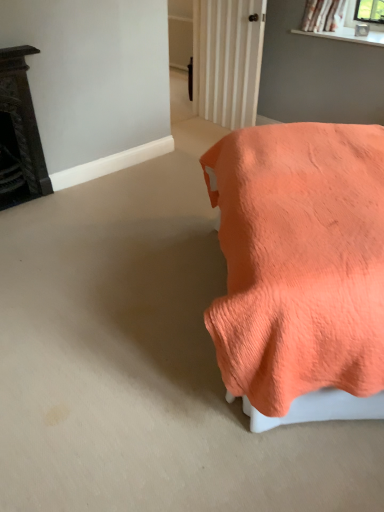
Describe the element at coordinates (300, 269) in the screenshot. I see `coral fabric bed at right, the 1th furniture from the right` at that location.

Find the location of a particular element. The width and height of the screenshot is (384, 512). coral fabric bed at right, the 1th furniture from the right is located at coordinates (300, 269).

Where is `dark brown ornate fireplace at left, which is the second furniture from right to left`? This screenshot has width=384, height=512. dark brown ornate fireplace at left, which is the second furniture from right to left is located at coordinates (19, 133).

The width and height of the screenshot is (384, 512). What do you see at coordinates (19, 133) in the screenshot? I see `dark brown ornate fireplace at left, arranged as the 1th furniture when viewed from the left` at bounding box center [19, 133].

Find the location of a particular element. Image resolution: width=384 pixels, height=512 pixels. coral fabric bed at right, which is the 2th furniture from left to right is located at coordinates (300, 269).

In the scene shown: Considering the relative positions of coral fabric bed at right, which is the 2th furniture from left to right, and dark brown ornate fireplace at left, which is the second furniture from right to left, in the image provided, is coral fabric bed at right, which is the 2th furniture from left to right, to the left of dark brown ornate fireplace at left, which is the second furniture from right to left, from the viewer's perspective?

No.

In the image, is coral fabric bed at right, the 1th furniture from the right, positioned in front of or behind dark brown ornate fireplace at left, which is the second furniture from right to left?

coral fabric bed at right, the 1th furniture from the right, is positioned closer to the viewer than dark brown ornate fireplace at left, which is the second furniture from right to left.

Is point (296, 178) in front of point (19, 50)?

Yes, point (296, 178) is closer to viewer.

From the image's perspective, which is below, coral fabric bed at right, the 1th furniture from the right, or dark brown ornate fireplace at left, arranged as the 1th furniture when viewed from the left?

coral fabric bed at right, the 1th furniture from the right, from the image's perspective.

From a real-world perspective, who is located higher, coral fabric bed at right, the 1th furniture from the right, or dark brown ornate fireplace at left, arranged as the 1th furniture when viewed from the left?

coral fabric bed at right, the 1th furniture from the right, is physically above.

Can you confirm if coral fabric bed at right, the 1th furniture from the right, is wider than dark brown ornate fireplace at left, which is the second furniture from right to left?

Correct, the width of coral fabric bed at right, the 1th furniture from the right, exceeds that of dark brown ornate fireplace at left, which is the second furniture from right to left.

Considering the relative sizes of coral fabric bed at right, the 1th furniture from the right, and dark brown ornate fireplace at left, which is the second furniture from right to left, in the image provided, is coral fabric bed at right, the 1th furniture from the right, shorter than dark brown ornate fireplace at left, which is the second furniture from right to left,?

No, coral fabric bed at right, the 1th furniture from the right, is not shorter than dark brown ornate fireplace at left, which is the second furniture from right to left.

In terms of size, does coral fabric bed at right, the 1th furniture from the right, appear bigger or smaller than dark brown ornate fireplace at left, arranged as the 1th furniture when viewed from the left?

Considering their sizes, coral fabric bed at right, the 1th furniture from the right, takes up more space than dark brown ornate fireplace at left, arranged as the 1th furniture when viewed from the left.

Is dark brown ornate fireplace at left, arranged as the 1th furniture when viewed from the left, a part of coral fabric bed at right, which is the 2th furniture from left to right?

No.

Is coral fabric bed at right, which is the 2th furniture from left to right, with dark brown ornate fireplace at left, arranged as the 1th furniture when viewed from the left?

No, coral fabric bed at right, which is the 2th furniture from left to right, is not touching dark brown ornate fireplace at left, arranged as the 1th furniture when viewed from the left.

Is coral fabric bed at right, the 1th furniture from the right, oriented away from dark brown ornate fireplace at left, arranged as the 1th furniture when viewed from the left?

coral fabric bed at right, the 1th furniture from the right, is not turned away from dark brown ornate fireplace at left, arranged as the 1th furniture when viewed from the left.

Can you tell me how much coral fabric bed at right, which is the 2th furniture from left to right, and dark brown ornate fireplace at left, which is the second furniture from right to left, differ in facing direction?

134 degrees separate the facing orientations of coral fabric bed at right, which is the 2th furniture from left to right, and dark brown ornate fireplace at left, which is the second furniture from right to left.

Where is `furniture in front of the dark brown ornate fireplace at left, which is the second furniture from right to left`? The height and width of the screenshot is (512, 384). furniture in front of the dark brown ornate fireplace at left, which is the second furniture from right to left is located at coordinates click(300, 269).

Between dark brown ornate fireplace at left, which is the second furniture from right to left, and coral fabric bed at right, which is the 2th furniture from left to right, which one appears on the left side from the viewer's perspective?

dark brown ornate fireplace at left, which is the second furniture from right to left.

Considering the positions of objects dark brown ornate fireplace at left, arranged as the 1th furniture when viewed from the left, and coral fabric bed at right, the 1th furniture from the right, in the image provided, who is behind, dark brown ornate fireplace at left, arranged as the 1th furniture when viewed from the left, or coral fabric bed at right, the 1th furniture from the right,?

dark brown ornate fireplace at left, arranged as the 1th furniture when viewed from the left, is behind.

Considering the positions of points (10, 181) and (276, 298), is point (10, 181) closer to camera compared to point (276, 298)?

That is False.

From the image's perspective, is dark brown ornate fireplace at left, arranged as the 1th furniture when viewed from the left, located above or below coral fabric bed at right, which is the 2th furniture from left to right?

Clearly, from the image's perspective, dark brown ornate fireplace at left, arranged as the 1th furniture when viewed from the left, is above coral fabric bed at right, which is the 2th furniture from left to right.

From a real-world perspective, is dark brown ornate fireplace at left, arranged as the 1th furniture when viewed from the left, positioned over coral fabric bed at right, the 1th furniture from the right, based on gravity?

No, from a real-world perspective, dark brown ornate fireplace at left, arranged as the 1th furniture when viewed from the left, is not over coral fabric bed at right, the 1th furniture from the right

Considering the sizes of dark brown ornate fireplace at left, arranged as the 1th furniture when viewed from the left, and coral fabric bed at right, which is the 2th furniture from left to right, in the image, is dark brown ornate fireplace at left, arranged as the 1th furniture when viewed from the left, wider or thinner than coral fabric bed at right, which is the 2th furniture from left to right,?

Considering their sizes, dark brown ornate fireplace at left, arranged as the 1th furniture when viewed from the left, looks slimmer than coral fabric bed at right, which is the 2th furniture from left to right.

Who is taller, dark brown ornate fireplace at left, arranged as the 1th furniture when viewed from the left, or coral fabric bed at right, which is the 2th furniture from left to right?

coral fabric bed at right, which is the 2th furniture from left to right.

In terms of size, does dark brown ornate fireplace at left, which is the second furniture from right to left, appear bigger or smaller than coral fabric bed at right, the 1th furniture from the right?

Clearly, dark brown ornate fireplace at left, which is the second furniture from right to left, is smaller in size than coral fabric bed at right, the 1th furniture from the right.

Is dark brown ornate fireplace at left, arranged as the 1th furniture when viewed from the left, not inside coral fabric bed at right, which is the 2th furniture from left to right?

dark brown ornate fireplace at left, arranged as the 1th furniture when viewed from the left, lies outside coral fabric bed at right, which is the 2th furniture from left to right,'s area.

Would you consider dark brown ornate fireplace at left, arranged as the 1th furniture when viewed from the left, to be distant from coral fabric bed at right, which is the 2th furniture from left to right?

Yes.

Could you tell me if dark brown ornate fireplace at left, arranged as the 1th furniture when viewed from the left, is facing coral fabric bed at right, which is the 2th furniture from left to right?

Yes, dark brown ornate fireplace at left, arranged as the 1th furniture when viewed from the left, faces towards coral fabric bed at right, which is the 2th furniture from left to right.

Can you tell me how much dark brown ornate fireplace at left, which is the second furniture from right to left, and coral fabric bed at right, which is the 2th furniture from left to right, differ in facing direction?

dark brown ornate fireplace at left, which is the second furniture from right to left, and coral fabric bed at right, which is the 2th furniture from left to right, are facing 134 degrees away from each other.

You are a GUI agent. You are given a task and a screenshot of the screen. Output one action in this format:
    pyautogui.click(x=<x>, y=<y>)
    Task: Click on the furniture above the dark brown ornate fireplace at left, which is the second furniture from right to left (from a real-world perspective)
    This screenshot has width=384, height=512.
    Given the screenshot: What is the action you would take?
    click(x=300, y=269)

This screenshot has width=384, height=512. I want to click on furniture above the coral fabric bed at right, the 1th furniture from the right (from the image's perspective), so click(19, 133).

You are a GUI agent. You are given a task and a screenshot of the screen. Output one action in this format:
    pyautogui.click(x=<x>, y=<y>)
    Task: Click on the furniture on the right of dark brown ornate fireplace at left, arranged as the 1th furniture when viewed from the left
    
    Given the screenshot: What is the action you would take?
    pyautogui.click(x=300, y=269)